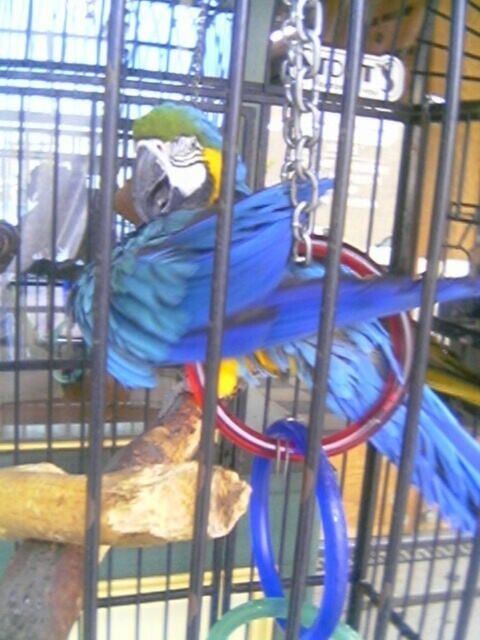
Question: Which of the following is the farthest from the observer?

Choices:
 (A) blue glossy parrot at center
 (B) metallic silver chain at upper right

Answer: (B)

Question: Is blue glossy parrot at center wider than metallic silver chain at upper right?

Choices:
 (A) no
 (B) yes

Answer: (B)

Question: Can you confirm if blue glossy parrot at center is positioned above metallic silver chain at upper right?

Choices:
 (A) yes
 (B) no

Answer: (B)

Question: Is blue glossy parrot at center thinner than metallic silver chain at upper right?

Choices:
 (A) yes
 (B) no

Answer: (B)